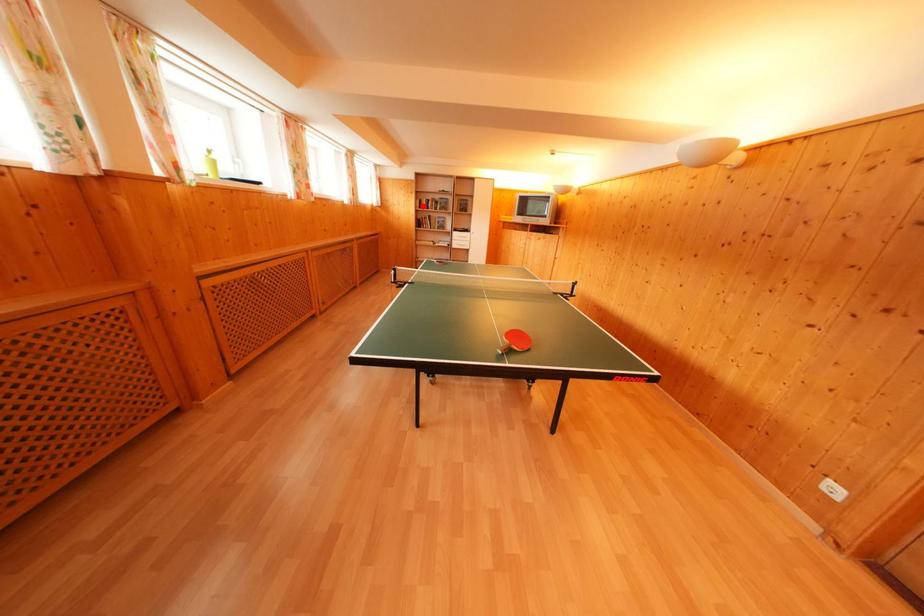
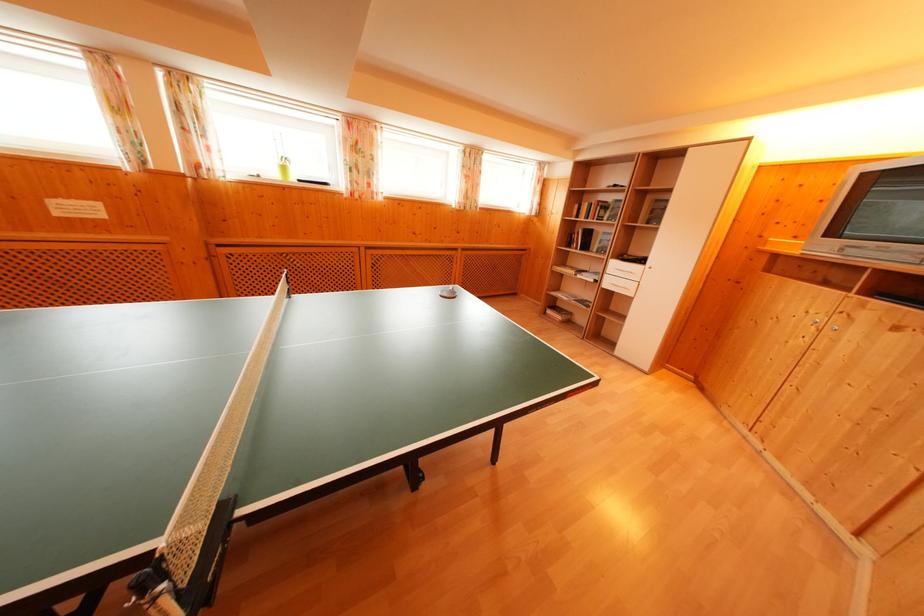
Locate, in the second image, the point that corresponds to the highlighted location in the first image.

(581, 211)